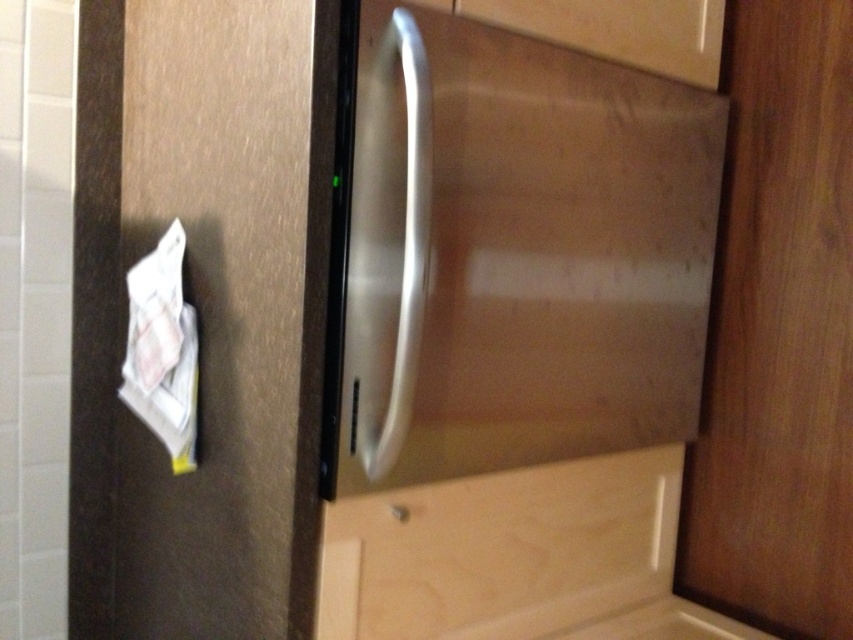
Is brown matte door at left shorter than wooden door at right?

Yes, brown matte door at left is shorter than wooden door at right.

Image resolution: width=853 pixels, height=640 pixels. What are the coordinates of `brown matte door at left` in the screenshot? It's located at (202, 312).

Locate an element on the screen. This screenshot has height=640, width=853. brown matte door at left is located at coordinates (202, 312).

This screenshot has height=640, width=853. What are the coordinates of `satin silver handle at center` in the screenshot? It's located at (389, 244).

Does satin silver handle at center appear under matte wood drawer at upper center?

Yes.

Between point (428, 76) and point (671, 61), which one is positioned behind?

The point (671, 61) is behind.

Where is `satin silver handle at center`? Image resolution: width=853 pixels, height=640 pixels. satin silver handle at center is located at coordinates (389, 244).

From the picture: Between brown matte door at left and matte wood drawer at upper center, which one has less height?

matte wood drawer at upper center

Is point (90, 282) closer to camera compared to point (704, 4)?

Yes, point (90, 282) is in front of point (704, 4).

Locate an element on the screen. Image resolution: width=853 pixels, height=640 pixels. brown matte door at left is located at coordinates (202, 312).